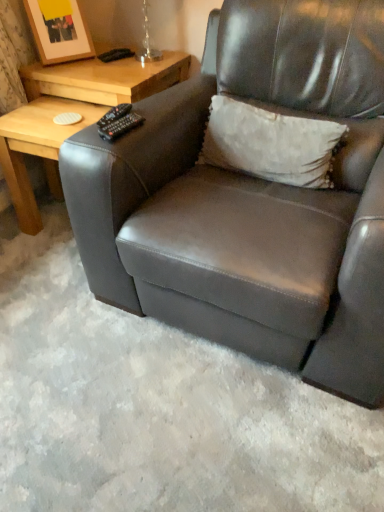
Question: Is matte black armchair at center not within black plastic remote at upper left?

Choices:
 (A) yes
 (B) no

Answer: (A)

Question: Would you say matte black armchair at center is a long distance from black plastic remote at upper left?

Choices:
 (A) yes
 (B) no

Answer: (B)

Question: From the image's perspective, is matte black armchair at center on top of black plastic remote at upper left?

Choices:
 (A) no
 (B) yes

Answer: (A)

Question: Is black plastic remote at upper left completely or partially inside matte black armchair at center?

Choices:
 (A) yes
 (B) no

Answer: (A)

Question: From a real-world perspective, is matte black armchair at center physically below black plastic remote at upper left?

Choices:
 (A) yes
 (B) no

Answer: (A)

Question: Is the position of matte black armchair at center more distant than that of black plastic remote at upper left?

Choices:
 (A) no
 (B) yes

Answer: (A)

Question: Does wooden picture frame at upper left come behind light brown wood table at upper left, the 2th table in the bottom-to-top sequence?

Choices:
 (A) yes
 (B) no

Answer: (A)

Question: Can you confirm if wooden picture frame at upper left is wider than light brown wood table at upper left, the first table in the top-to-bottom sequence?

Choices:
 (A) yes
 (B) no

Answer: (B)

Question: Is wooden picture frame at upper left positioned in front of light brown wood table at upper left, the 2th table in the bottom-to-top sequence?

Choices:
 (A) yes
 (B) no

Answer: (B)

Question: From a real-world perspective, is wooden picture frame at upper left located beneath light brown wood table at upper left, the first table in the top-to-bottom sequence?

Choices:
 (A) no
 (B) yes

Answer: (A)

Question: Is wooden picture frame at upper left looking in the opposite direction of light brown wood table at upper left, the 2th table in the bottom-to-top sequence?

Choices:
 (A) no
 (B) yes

Answer: (A)

Question: Is there a large distance between wooden picture frame at upper left and light brown wood table at upper left, the first table in the top-to-bottom sequence?

Choices:
 (A) yes
 (B) no

Answer: (B)

Question: Would you say light brown wood table at upper left, the 2th table in the bottom-to-top sequence, is outside wooden picture frame at upper left?

Choices:
 (A) yes
 (B) no

Answer: (A)